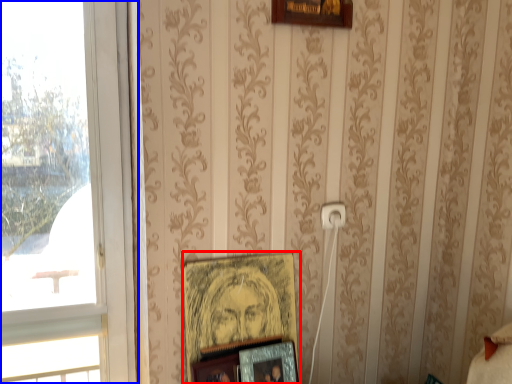
Question: Among these objects, which one is nearest to the camera, picture frame (highlighted by a red box) or window (highlighted by a blue box)?

Choices:
 (A) picture frame
 (B) window

Answer: (B)